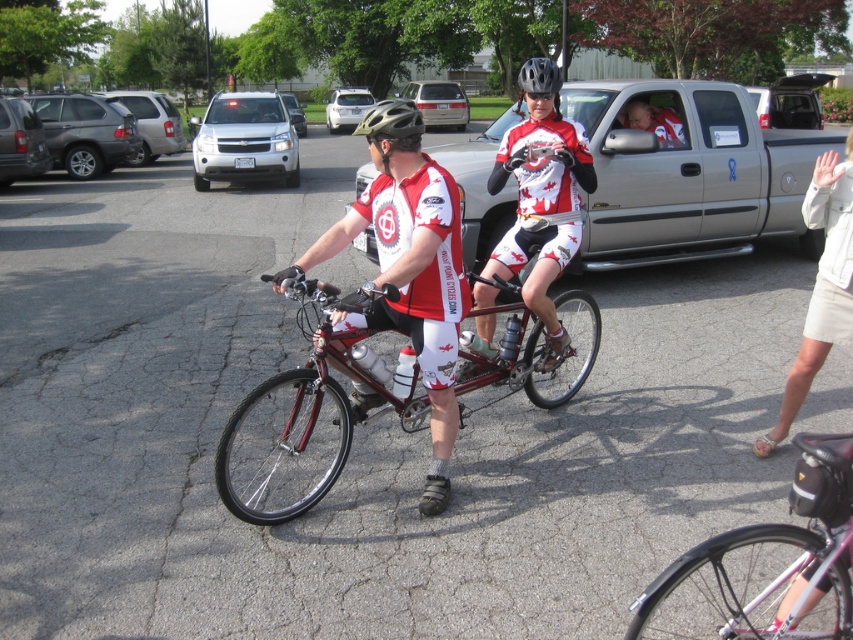
You are a delivery driver who needs to park your vehicle between the matte silver suv at left and the silver metallic van at center. Given that the space between them is 3 meters wide, and your delivery van is 2.8 meters wide, can you safely park your vehicle in that space?

The space between the matte silver suv at left and the silver metallic van at center is 3 meters wide. Since your delivery van is 2.8 meters wide, which is narrower than the available space, you can safely park your vehicle in that space.

You are a delivery driver who needs to park your car between the matte silver suv at left and the silver metallic van at center. Can you safely park your car there?

The matte silver suv at left is closer to the viewer than the silver metallic van at center, so there is a distance between them. However, without knowing the exact space available, it is difficult to determine if your car can fit. Please check the available space before attempting to park.